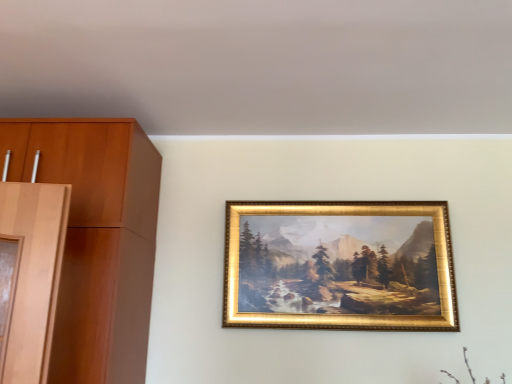
Question: Is gold metallic frame at center in front of or behind wooden cabinet at left in the image?

Choices:
 (A) front
 (B) behind

Answer: (B)

Question: From a real-world perspective, is gold metallic frame at center above or below wooden cabinet at left?

Choices:
 (A) above
 (B) below

Answer: (B)

Question: Considering the positions of point (320, 230) and point (144, 170), is point (320, 230) closer or farther from the camera than point (144, 170)?

Choices:
 (A) farther
 (B) closer

Answer: (A)

Question: Is wooden cabinet at left taller or shorter than gold metallic frame at center?

Choices:
 (A) short
 (B) tall

Answer: (B)

Question: Is point (65, 284) closer or farther from the camera than point (263, 296)?

Choices:
 (A) farther
 (B) closer

Answer: (B)

Question: From a real-world perspective, is wooden cabinet at left positioned above or below gold metallic frame at center?

Choices:
 (A) below
 (B) above

Answer: (B)

Question: From the image's perspective, is wooden cabinet at left positioned above or below gold metallic frame at center?

Choices:
 (A) above
 (B) below

Answer: (A)